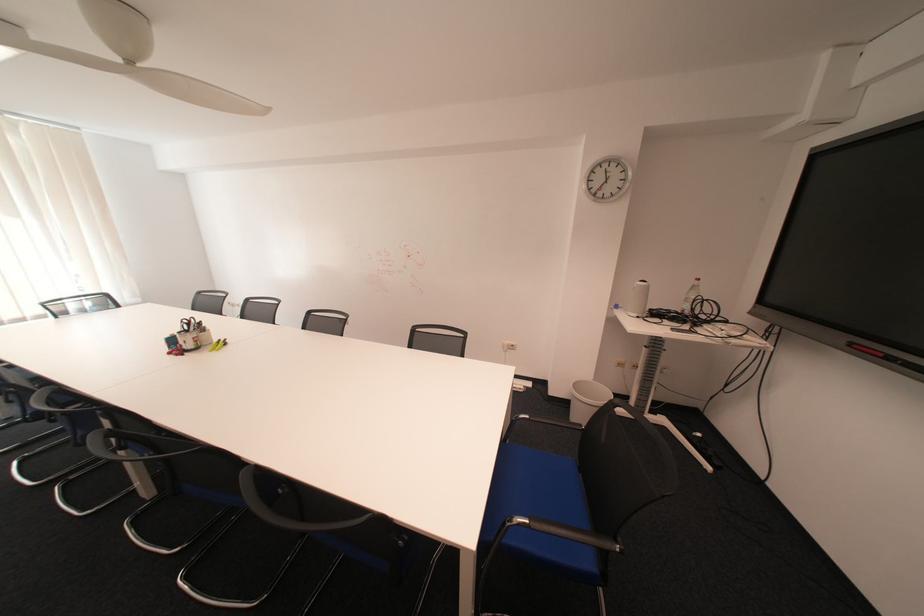
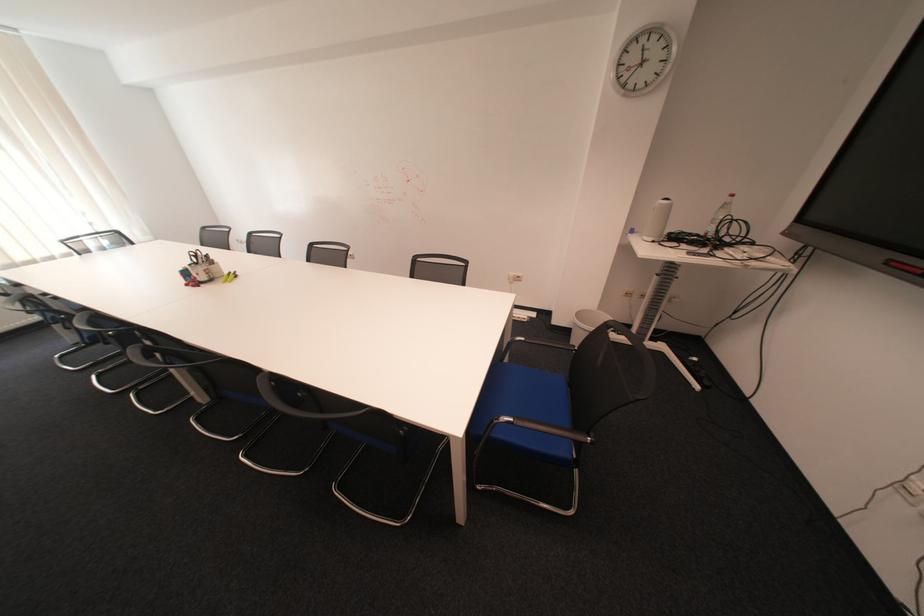
In the second image, find the point that corresponds to point 209,349 in the first image.

(223, 281)